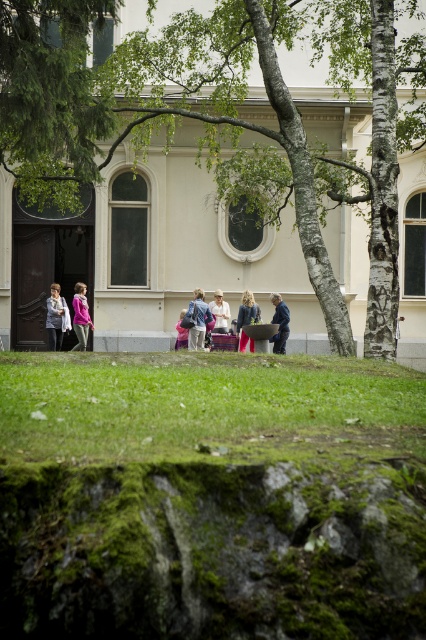
Question: Can you confirm if matte blue backpack at center is smaller than pink fabric jacket at center?

Choices:
 (A) no
 (B) yes

Answer: (B)

Question: Can you confirm if green grass at lower center is bigger than matte pink sweater at center?

Choices:
 (A) no
 (B) yes

Answer: (A)

Question: Considering the real-world distances, which object is farthest from the matte white shirt at center?

Choices:
 (A) dark blue jeans at center
 (B) green leafy tree at upper left

Answer: (B)

Question: Which point appears farthest from the camera in this image?

Choices:
 (A) (284, 324)
 (B) (66, 326)

Answer: (B)

Question: Is matte white shirt at center to the left of matte pink sweater at center from the viewer's perspective?

Choices:
 (A) yes
 (B) no

Answer: (B)

Question: Which of the following is the closest to the observer?

Choices:
 (A) (74, 45)
 (B) (46, 77)
 (C) (213, 305)
 (D) (66, 458)

Answer: (D)